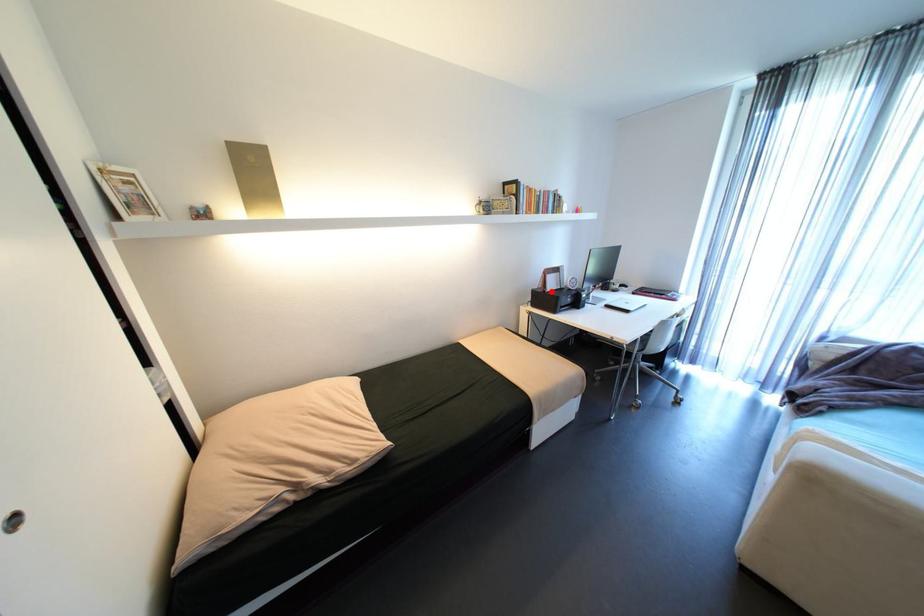
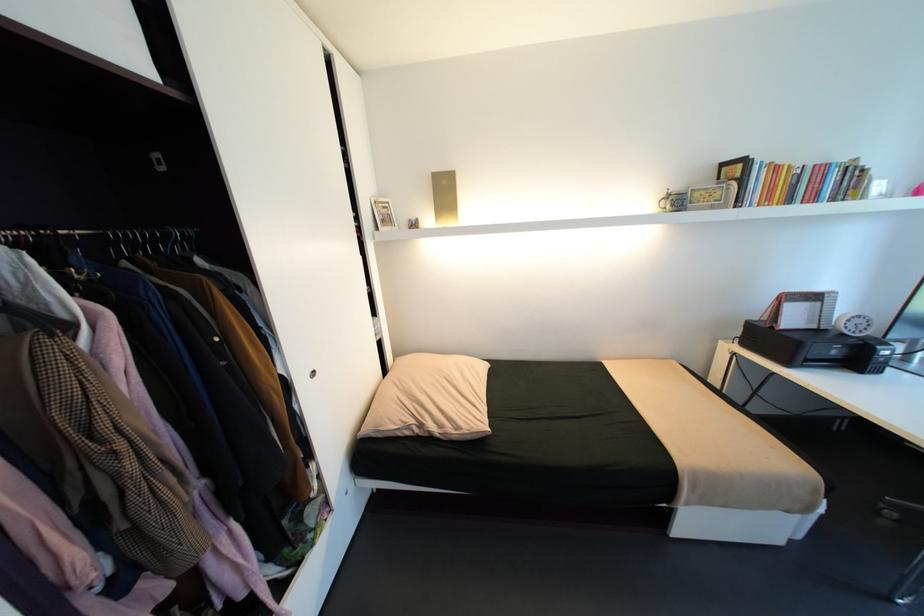
Locate, in the second image, the point that corresponds to the highlighted location in the first image.

(779, 328)